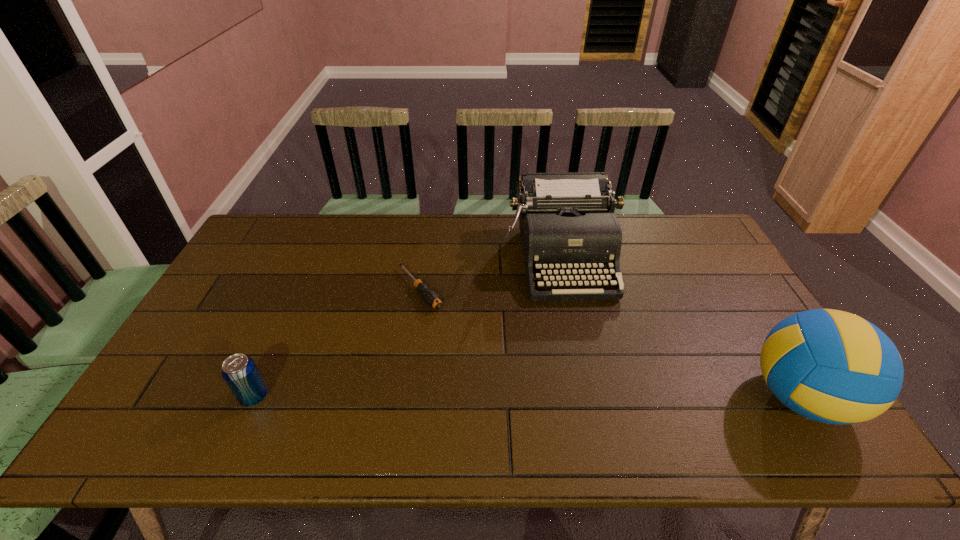
This screenshot has width=960, height=540. I want to click on vacant space on the desktop that is between the beer can and the rightmost object and is positioned at the tip of the screwdriver, so click(x=518, y=397).

Identify the location of vacant spot on the desktop that is between the beer can and the rightmost object and is positioned on the front-facing side of the third shortest object. (596, 397).